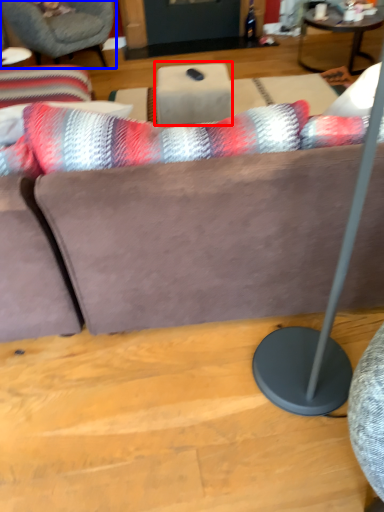
Question: Which point is further to the camera, table (highlighted by a red box) or chair (highlighted by a blue box)?

Choices:
 (A) table
 (B) chair

Answer: (B)